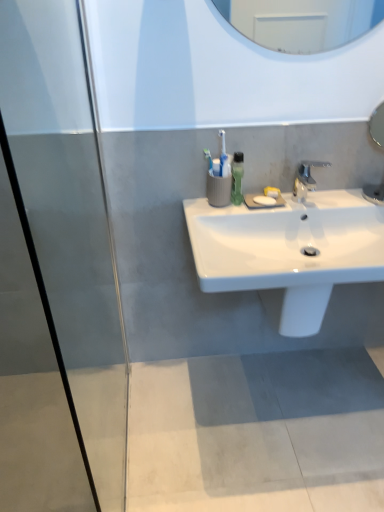
Question: Is the depth of silver metallic faucet at center less than that of green matte soap dispenser at upper center?

Choices:
 (A) no
 (B) yes

Answer: (B)

Question: From the image's perspective, is silver metallic faucet at center below green matte soap dispenser at upper center?

Choices:
 (A) no
 (B) yes

Answer: (B)

Question: Does silver metallic faucet at center have a greater height compared to green matte soap dispenser at upper center?

Choices:
 (A) no
 (B) yes

Answer: (A)

Question: Considering the relative sizes of silver metallic faucet at center and green matte soap dispenser at upper center in the image provided, is silver metallic faucet at center smaller than green matte soap dispenser at upper center?

Choices:
 (A) yes
 (B) no

Answer: (B)

Question: Is the position of silver metallic faucet at center more distant than that of green matte soap dispenser at upper center?

Choices:
 (A) yes
 (B) no

Answer: (B)

Question: Looking at their shapes, would you say green matte soap dispenser at upper center is wider or thinner than white glossy sink at center?

Choices:
 (A) wide
 (B) thin

Answer: (B)

Question: Is green matte soap dispenser at upper center to the left or to the right of white glossy sink at center in the image?

Choices:
 (A) right
 (B) left

Answer: (B)

Question: Based on their sizes in the image, would you say green matte soap dispenser at upper center is bigger or smaller than white glossy sink at center?

Choices:
 (A) small
 (B) big

Answer: (A)

Question: Relative to white glossy sink at center, is green matte soap dispenser at upper center in front or behind?

Choices:
 (A) front
 (B) behind

Answer: (B)

Question: Is silver metallic faucet at center spatially inside white glossy sink at center, or outside of it?

Choices:
 (A) inside
 (B) outside

Answer: (B)

Question: Is point (317, 160) closer or farther from the camera than point (357, 262)?

Choices:
 (A) farther
 (B) closer

Answer: (A)

Question: From their relative heights in the image, would you say silver metallic faucet at center is taller or shorter than white glossy sink at center?

Choices:
 (A) short
 (B) tall

Answer: (B)

Question: From the image's perspective, relative to white glossy sink at center, is silver metallic faucet at center above or below?

Choices:
 (A) below
 (B) above

Answer: (B)

Question: Is white glossy sink at center taller or shorter than green matte soap dispenser at upper center?

Choices:
 (A) short
 (B) tall

Answer: (A)

Question: Looking at their shapes, would you say white glossy sink at center is wider or thinner than green matte soap dispenser at upper center?

Choices:
 (A) wide
 (B) thin

Answer: (A)